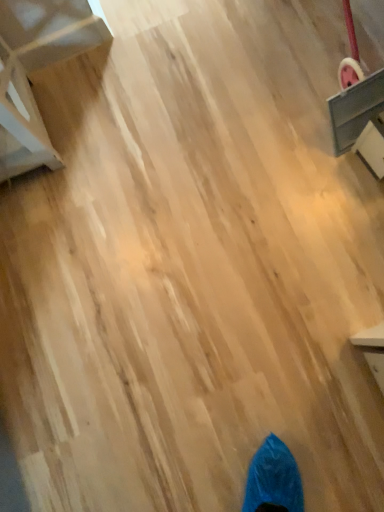
This screenshot has width=384, height=512. I want to click on vacant area in front of white matte chair at upper left, the second furniture viewed from the right, so click(69, 215).